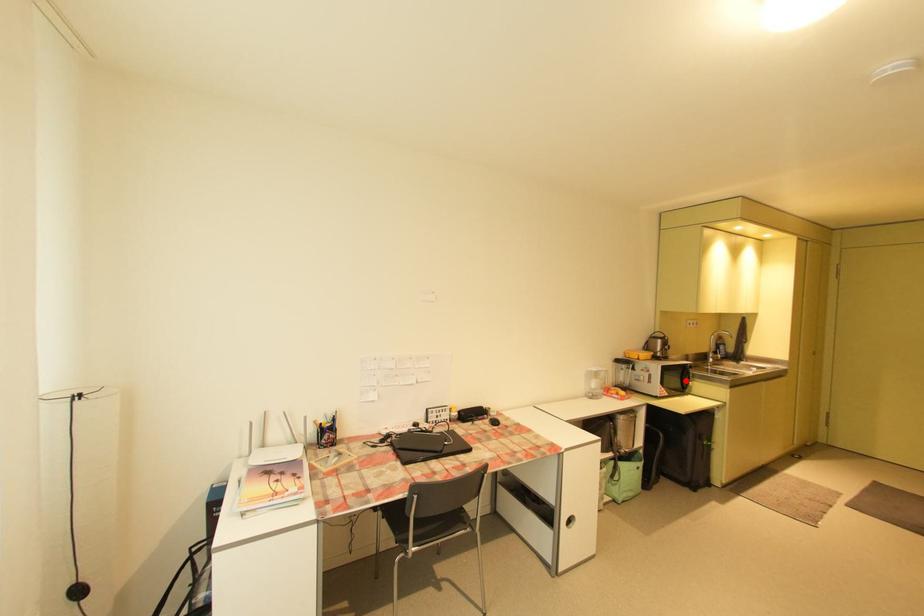
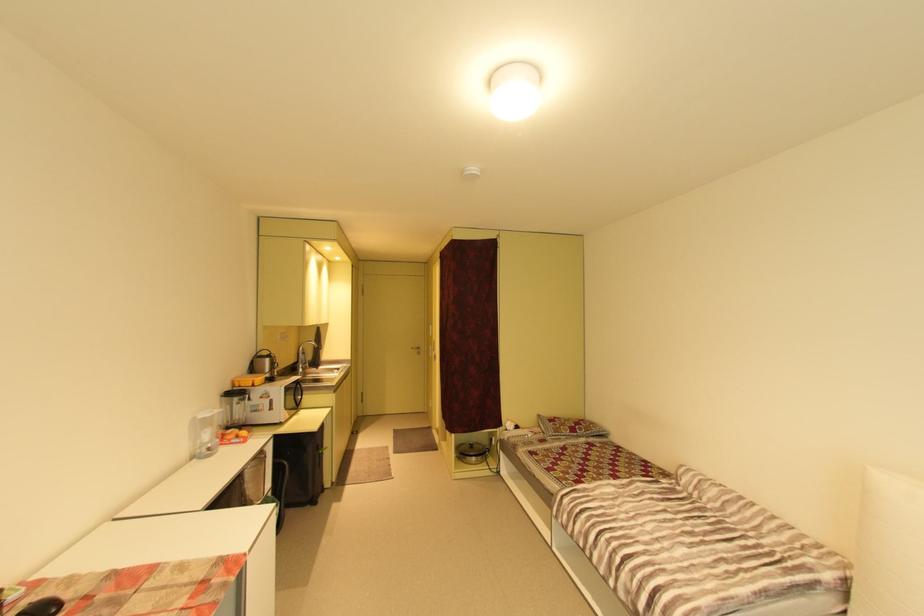
The point at the highlighted location is marked in the first image. Where is the corresponding point in the second image?

(299, 398)